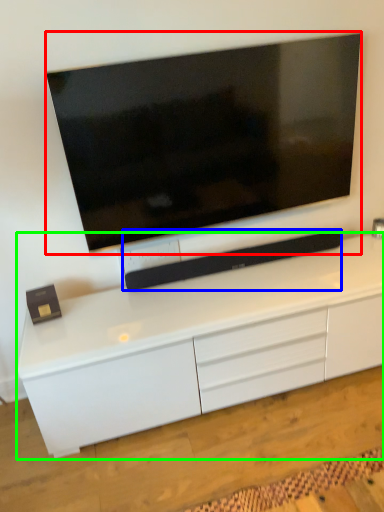
Question: Which object is positioned closest to television (highlighted by a red box)? Select from equipment (highlighted by a blue box) and cabinetry (highlighted by a green box).

Choices:
 (A) equipment
 (B) cabinetry

Answer: (A)